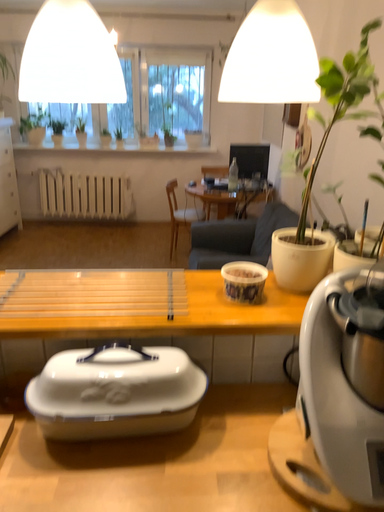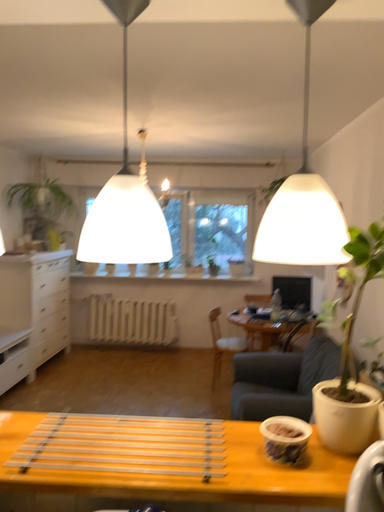
Question: How did the camera likely rotate when shooting the video?

Choices:
 (A) rotated upward
 (B) rotated downward

Answer: (A)